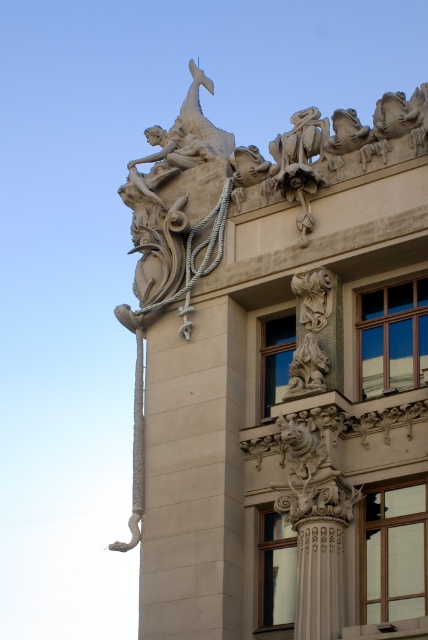
You are an architect designing a new building and want to incorporate two columns in the center of the facade. The beige stone column at center and the white stone column at center must be placed side by side. Which column should you place on the left to ensure the wider column is on the right?

The beige stone column at center is wider than the white stone column at center, so to have the wider column on the right, place the beige stone column at center on the right side and the white stone column at center on the left side.

You are standing in front of the building and notice a point marked at coordinates (193,477). According to the image, what object is located at that point?

The point at coordinates (193,477) indicates the beige stone column at center.